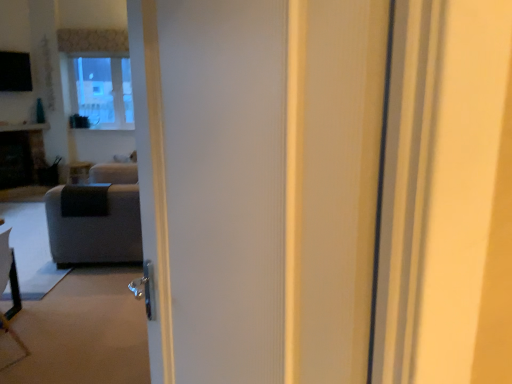
Question: Is dark gray stone fireplace at left located within gray fabric couch at left?

Choices:
 (A) no
 (B) yes

Answer: (A)

Question: Is dark gray stone fireplace at left at the back of gray fabric couch at left?

Choices:
 (A) no
 (B) yes

Answer: (A)

Question: Is gray fabric couch at left at the left side of dark gray stone fireplace at left?

Choices:
 (A) no
 (B) yes

Answer: (A)

Question: From a real-world perspective, is gray fabric couch at left located higher than dark gray stone fireplace at left?

Choices:
 (A) no
 (B) yes

Answer: (A)

Question: From a real-world perspective, is gray fabric couch at left positioned under dark gray stone fireplace at left based on gravity?

Choices:
 (A) no
 (B) yes

Answer: (B)

Question: Would you say dark gray stone fireplace at left is inside or outside matte black side table at center?

Choices:
 (A) inside
 (B) outside

Answer: (B)

Question: In terms of width, does dark gray stone fireplace at left look wider or thinner when compared to matte black side table at center?

Choices:
 (A) thin
 (B) wide

Answer: (B)

Question: From a real-world perspective, relative to matte black side table at center, is dark gray stone fireplace at left vertically above or below?

Choices:
 (A) below
 (B) above

Answer: (B)

Question: Visually, is dark gray stone fireplace at left positioned to the left or to the right of matte black side table at center?

Choices:
 (A) left
 (B) right

Answer: (A)

Question: Relative to dark gray stone fireplace at left, is gray fabric couch at left in front or behind?

Choices:
 (A) front
 (B) behind

Answer: (A)

Question: Looking at the image, does gray fabric couch at left seem bigger or smaller compared to dark gray stone fireplace at left?

Choices:
 (A) small
 (B) big

Answer: (B)

Question: Would you say gray fabric couch at left is inside or outside dark gray stone fireplace at left?

Choices:
 (A) inside
 (B) outside

Answer: (B)

Question: Would you say gray fabric couch at left is to the left or to the right of dark gray stone fireplace at left in the picture?

Choices:
 (A) left
 (B) right

Answer: (B)

Question: Choose the correct answer: Is matte black side table at center inside dark gray stone fireplace at left or outside it?

Choices:
 (A) inside
 (B) outside

Answer: (B)

Question: Considering the positions of matte black side table at center and dark gray stone fireplace at left in the image, is matte black side table at center taller or shorter than dark gray stone fireplace at left?

Choices:
 (A) short
 (B) tall

Answer: (A)